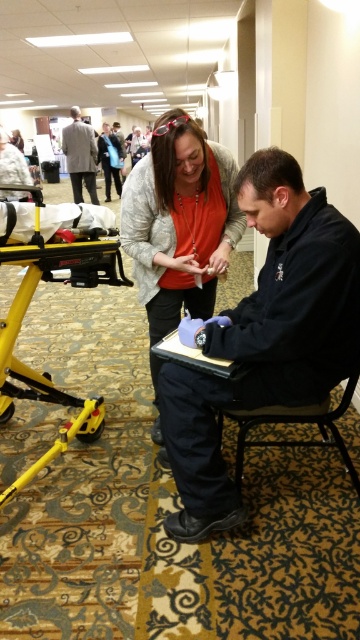
You are organizing a small event and need to place a 10 cm wide decorative plate between the matte gray sweater at center and the metallic blue chair at lower center. Can you fit it there?

The matte gray sweater at center is thinner than the metallic blue chair at lower center, so the space between them is sufficient to fit a 10 cm wide decorative plate.

You are organizing a photo shoot in this conference hall and need to place two props. The black matte jacket at center and the light gray suit at upper left must be positioned such that the smaller one is closer to the entrance. Which object should you place nearer to the entrance?

The black matte jacket at center has a smaller size compared to the light gray suit at upper left, so you should place the black matte jacket at center closer to the entrance.

You are attending a conference and need to approach the black matte jacket at center and the light gray suit at upper left. Which one would you reach first if you walk straight ahead from your current position?

You would reach the black matte jacket at center first because it is closer to you than the light gray suit at upper left.